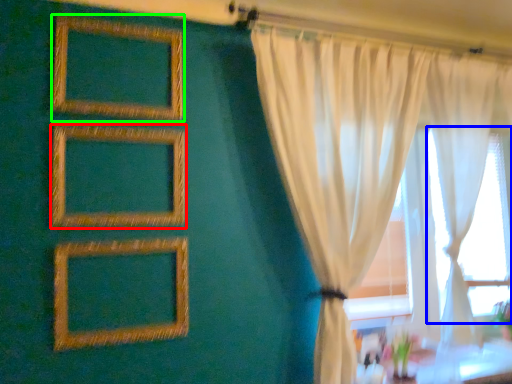
Question: Estimate the real-world distances between objects in this image. Which object is farther from picture frame (highlighted by a red box), bay window (highlighted by a blue box) or picture frame (highlighted by a green box)?

Choices:
 (A) bay window
 (B) picture frame

Answer: (A)